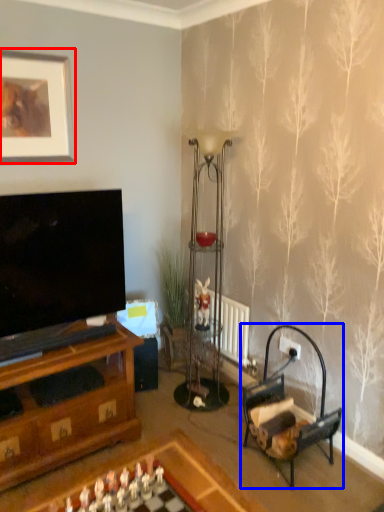
Question: Among these objects, which one is farthest to the camera, picture frame (highlighted by a red box) or armchair (highlighted by a blue box)?

Choices:
 (A) picture frame
 (B) armchair

Answer: (A)